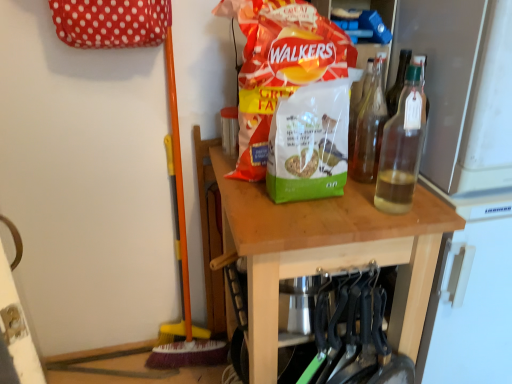
In order to click on free location in front of green matte birdseed bag at center, which is the second waste in top-to-bottom order in this screenshot , I will do `click(310, 222)`.